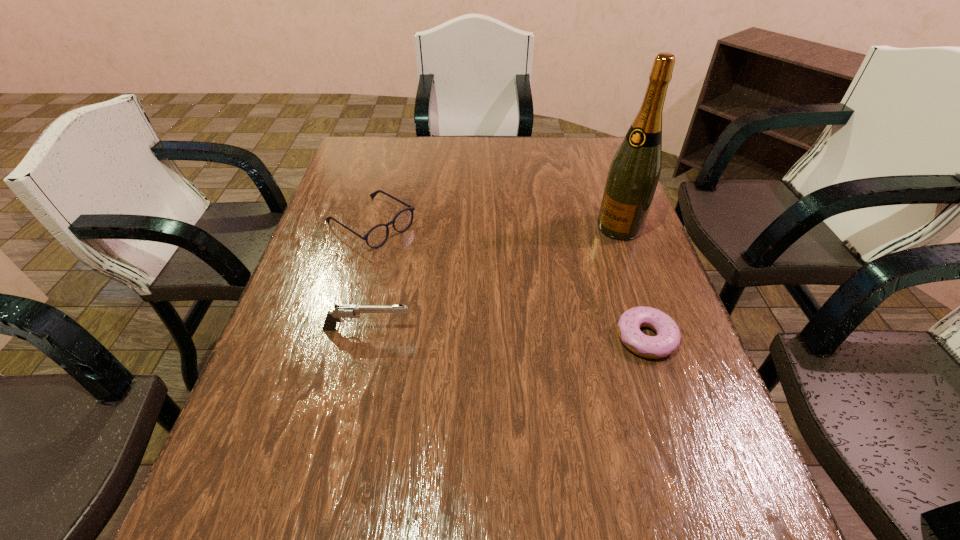
The height and width of the screenshot is (540, 960). Identify the location of the third shortest object. (341, 311).

Identify the location of doughnut. Image resolution: width=960 pixels, height=540 pixels. (668, 337).

You are a GUI agent. You are given a task and a screenshot of the screen. Output one action in this format:
    pyautogui.click(x=<x>, y=<y>)
    Task: Click on the spectacles
    
    Given the screenshot: What is the action you would take?
    pyautogui.click(x=377, y=236)

Image resolution: width=960 pixels, height=540 pixels. In order to click on the tallest object in this screenshot , I will do `click(632, 179)`.

Identify the location of vacant space located on the front-facing side of the third shortest object. click(497, 329).

Image resolution: width=960 pixels, height=540 pixels. What are the coordinates of `vacant space located on the left of the doughnut` in the screenshot? It's located at (x=529, y=337).

This screenshot has height=540, width=960. Identify the location of vacant point located on the front-facing side of the spectacles. (512, 315).

At what (x,y) coordinates should I click in order to perform the action: click on free point located 0.350m on the front-facing side of the spectacles. Please return your answer as a coordinate pair (x, y). This screenshot has width=960, height=540. Looking at the image, I should click on tap(501, 309).

At what (x,y) coordinates should I click in order to perform the action: click on vacant space located on the front-facing side of the spectacles. Please return your answer as a coordinate pair (x, y). The image size is (960, 540). Looking at the image, I should click on (438, 267).

Find the location of `vacant space located 0.250m on the front-facing side of the tallest object`. vacant space located 0.250m on the front-facing side of the tallest object is located at coordinates (551, 285).